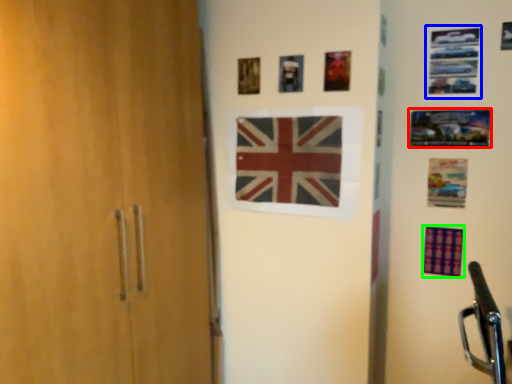
Question: Which is nearer to the picture frame (highlighted by a red box)? picture frame (highlighted by a blue box) or flag (highlighted by a green box).

Choices:
 (A) picture frame
 (B) flag

Answer: (A)